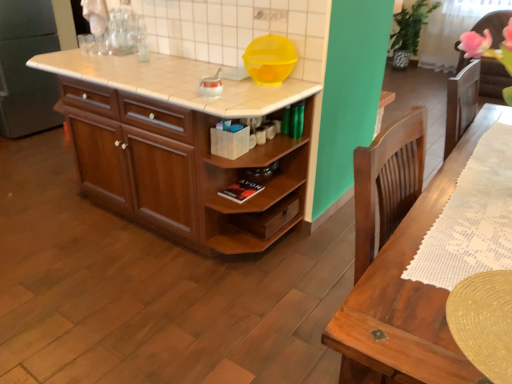
Question: Which direction should I rotate to look at white glossy kettle at center, which is the first appliance in left-to-right order, — up or down?

Choices:
 (A) up
 (B) down

Answer: (A)

Question: Is white tile countertop at center to the left of wooden cabinet at center from the viewer's perspective?

Choices:
 (A) no
 (B) yes

Answer: (B)

Question: Is white tile countertop at center far away from wooden cabinet at center?

Choices:
 (A) no
 (B) yes

Answer: (A)

Question: Considering the relative positions of white tile countertop at center and wooden cabinet at center in the image provided, is white tile countertop at center to the right of wooden cabinet at center from the viewer's perspective?

Choices:
 (A) no
 (B) yes

Answer: (A)

Question: Does white tile countertop at center have a lesser width compared to wooden cabinet at center?

Choices:
 (A) yes
 (B) no

Answer: (B)

Question: Is white tile countertop at center placed right next to wooden cabinet at center?

Choices:
 (A) no
 (B) yes

Answer: (A)

Question: Is wooden cabinet at center a part of white tile countertop at center?

Choices:
 (A) no
 (B) yes

Answer: (A)

Question: Does white tile countertop at center have a lesser height compared to white glossy kettle at center, which is the first appliance in left-to-right order?

Choices:
 (A) no
 (B) yes

Answer: (B)

Question: Can you confirm if white tile countertop at center is thinner than white glossy kettle at center, which ranks as the 2th appliance in right-to-left order?

Choices:
 (A) yes
 (B) no

Answer: (B)

Question: Considering the relative positions of white tile countertop at center and white glossy kettle at center, which is the first appliance in left-to-right order, in the image provided, is white tile countertop at center behind white glossy kettle at center, which is the first appliance in left-to-right order,?

Choices:
 (A) no
 (B) yes

Answer: (A)

Question: Is white tile countertop at center far from white glossy kettle at center, which is the first appliance in left-to-right order?

Choices:
 (A) no
 (B) yes

Answer: (A)

Question: Is white tile countertop at center aimed at white glossy kettle at center, which ranks as the 2th appliance in right-to-left order?

Choices:
 (A) yes
 (B) no

Answer: (B)

Question: From a real-world perspective, is white tile countertop at center physically below white glossy kettle at center, which ranks as the 2th appliance in right-to-left order?

Choices:
 (A) no
 (B) yes

Answer: (B)

Question: Considering the relative sizes of white glossy kettle at center, which ranks as the 2th appliance in right-to-left order, and yellow plastic bowl at upper center, the 1th appliance viewed from the right, in the image provided, is white glossy kettle at center, which ranks as the 2th appliance in right-to-left order, bigger than yellow plastic bowl at upper center, the 1th appliance viewed from the right,?

Choices:
 (A) yes
 (B) no

Answer: (B)